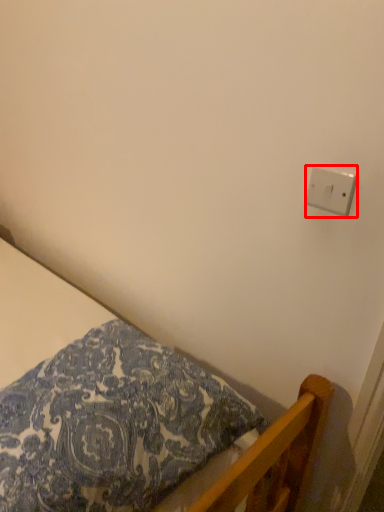
Question: From the image's perspective, what is the correct spatial positioning of light switch (annotated by the red box) in reference to bed?

Choices:
 (A) above
 (B) below

Answer: (A)